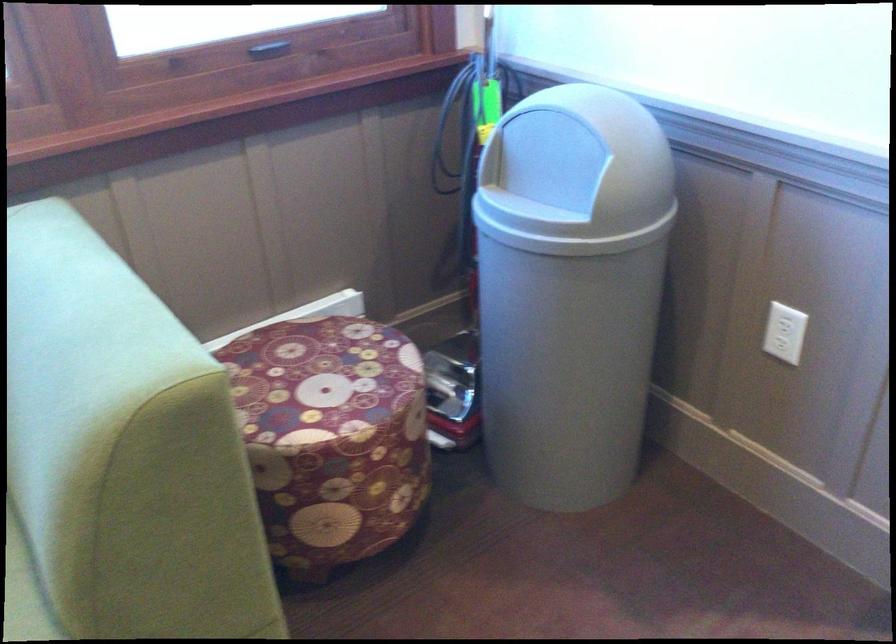
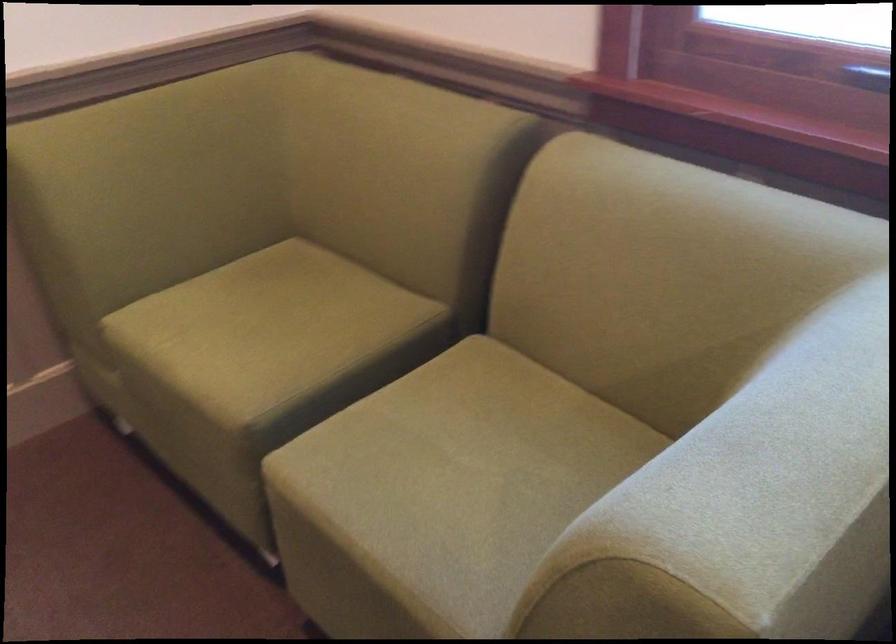
The images are taken continuously from a first-person perspective. In which direction is your viewpoint rotating?

The rotation direction of the camera is left-down.